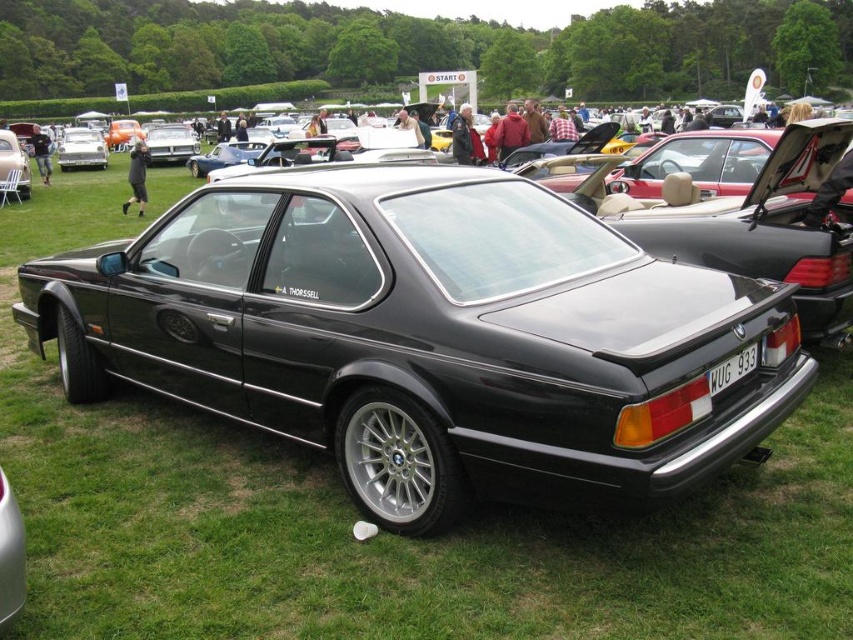
Question: Which of the following is the closest to the observer?

Choices:
 (A) (738, 358)
 (B) (3, 148)
 (C) (61, 147)

Answer: (A)

Question: Which point appears closest to the camera in this image?

Choices:
 (A) (13, 140)
 (B) (723, 378)

Answer: (B)

Question: Is metallic silver car at center behind matte black car at center?

Choices:
 (A) yes
 (B) no

Answer: (A)

Question: Which point is farther from the camera taking this photo?

Choices:
 (A) pos(24,189)
 (B) pos(91,157)

Answer: (B)

Question: Is metallic silver car at center to the right of white plastic license plate at center from the viewer's perspective?

Choices:
 (A) yes
 (B) no

Answer: (B)

Question: Can you confirm if metallic silver car at center is positioned above white plastic license plate at center?

Choices:
 (A) no
 (B) yes

Answer: (B)